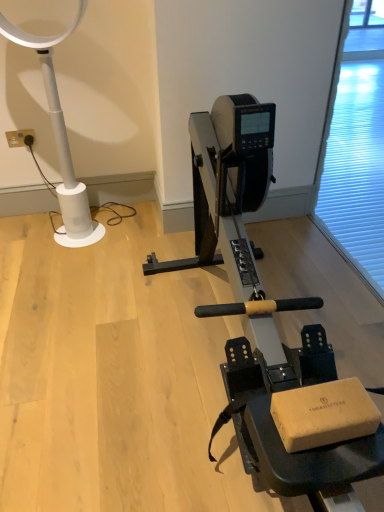
Question: Would you consider transparent plastic screen door at right to be distant from metallic silver stationary bicycle at center?

Choices:
 (A) no
 (B) yes

Answer: (A)

Question: From a real-world perspective, is transparent plastic screen door at right under metallic silver stationary bicycle at center?

Choices:
 (A) no
 (B) yes

Answer: (A)

Question: Can you confirm if transparent plastic screen door at right is taller than metallic silver stationary bicycle at center?

Choices:
 (A) no
 (B) yes

Answer: (B)

Question: Is transparent plastic screen door at right next to metallic silver stationary bicycle at center?

Choices:
 (A) yes
 (B) no

Answer: (B)

Question: Does transparent plastic screen door at right have a lesser width compared to metallic silver stationary bicycle at center?

Choices:
 (A) yes
 (B) no

Answer: (A)

Question: Considering the positions of white plastic electric outlet at upper left and metallic silver stationary bicycle at center in the image, is white plastic electric outlet at upper left taller or shorter than metallic silver stationary bicycle at center?

Choices:
 (A) tall
 (B) short

Answer: (B)

Question: Is white plastic electric outlet at upper left to the left or to the right of metallic silver stationary bicycle at center in the image?

Choices:
 (A) left
 (B) right

Answer: (A)

Question: Is white plastic electric outlet at upper left in front of or behind metallic silver stationary bicycle at center in the image?

Choices:
 (A) behind
 (B) front

Answer: (A)

Question: From a real-world perspective, is white plastic electric outlet at upper left positioned above or below metallic silver stationary bicycle at center?

Choices:
 (A) below
 (B) above

Answer: (A)

Question: Is metallic silver stationary bicycle at center situated inside white plastic lamp at left or outside?

Choices:
 (A) inside
 (B) outside

Answer: (B)

Question: Looking at their shapes, would you say metallic silver stationary bicycle at center is wider or thinner than white plastic lamp at left?

Choices:
 (A) wide
 (B) thin

Answer: (A)

Question: In terms of height, does metallic silver stationary bicycle at center look taller or shorter compared to white plastic lamp at left?

Choices:
 (A) short
 (B) tall

Answer: (A)

Question: In the image, is metallic silver stationary bicycle at center on the left side or the right side of white plastic lamp at left?

Choices:
 (A) right
 (B) left

Answer: (A)

Question: Is white plastic electric outlet at upper left in front of or behind transparent plastic screen door at right in the image?

Choices:
 (A) behind
 (B) front

Answer: (A)

Question: Considering the positions of white plastic electric outlet at upper left and transparent plastic screen door at right in the image, is white plastic electric outlet at upper left wider or thinner than transparent plastic screen door at right?

Choices:
 (A) thin
 (B) wide

Answer: (A)